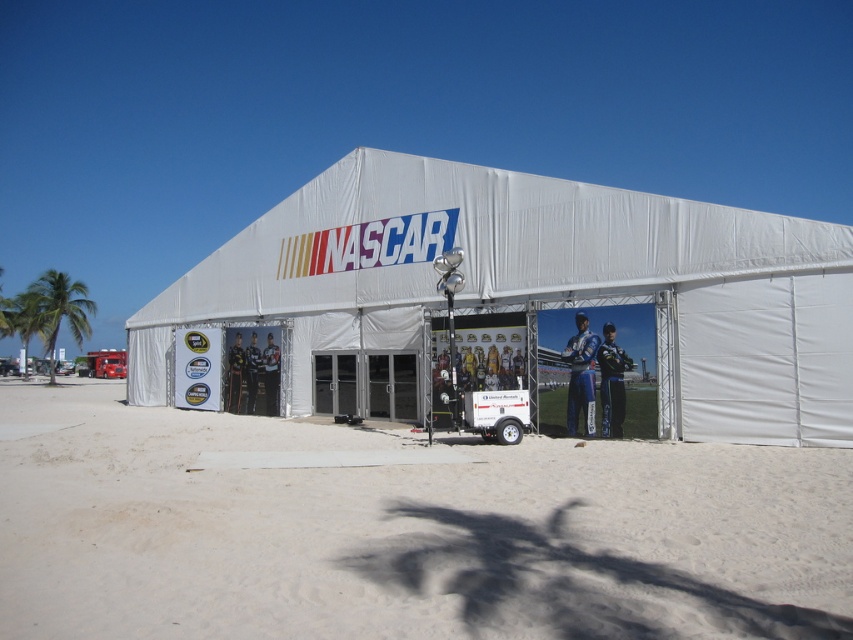
From the picture: You are standing at the entrance of the NASCAR event area and see the white fabric tent at center and the blue fabric suit at center. Which one is positioned more to the right?

The white fabric tent at center is positioned to the right of the blue fabric suit at center, so the white fabric tent at center is more to the right.

You are a photographer standing at the entrance of the NASCAR tent. You want to take a photo of the white sand at lower center and the blue fabric suit at center. Can you fit both subjects in the frame without moving your position? Explain your reasoning based on their distance apart.

The white sand at lower center and blue fabric suit at center are 25.07 feet apart. Since the distance between them is relatively large, it might be challenging to fit both in the frame from your current position without moving. Consider adjusting your position or using a wider lens to capture both subjects.